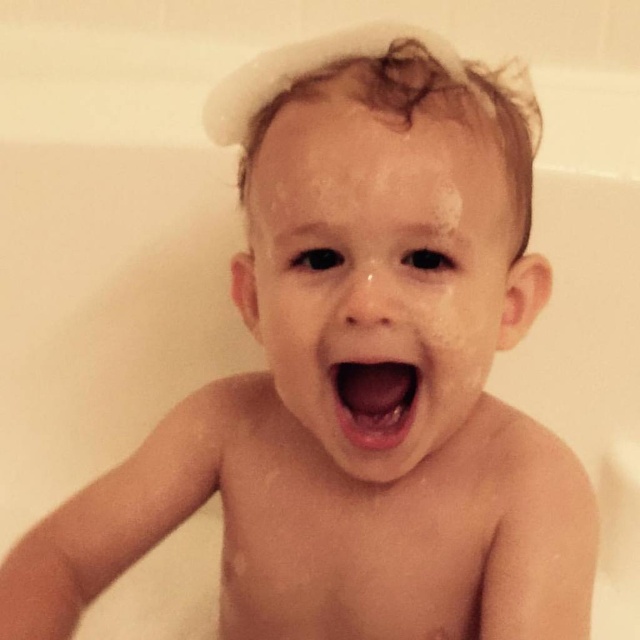
Question: Which object is closer to the camera taking this photo?

Choices:
 (A) pink glossy lips at center
 (B) wet skin face at center

Answer: (B)

Question: Can you confirm if wet skin face at center is bigger than pink glossy lips at center?

Choices:
 (A) yes
 (B) no

Answer: (A)

Question: Is wet skin face at center smaller than pink glossy lips at center?

Choices:
 (A) no
 (B) yes

Answer: (A)

Question: Can you confirm if wet skin face at center is positioned below pink glossy lips at center?

Choices:
 (A) no
 (B) yes

Answer: (A)

Question: Which object is closer to the camera taking this photo?

Choices:
 (A) wet skin face at center
 (B) pink glossy lips at center

Answer: (A)